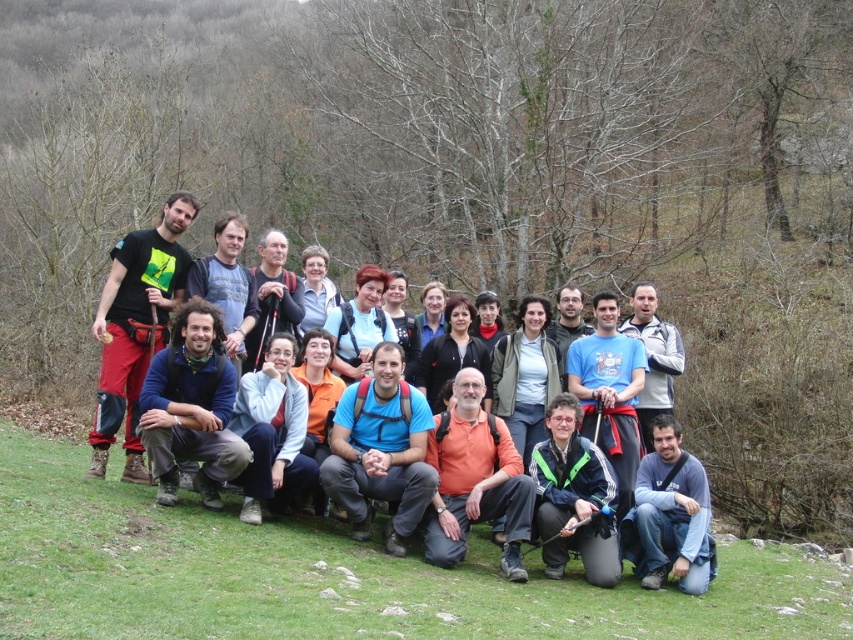
You are standing at point (674, 515) and want to walk to the forest edge. There is another point at (173, 228). Which direction should you move relative to that point?

Since point (173, 228) is behind point (674, 515), you should move in the opposite direction of point (173, 228) to reach the forest edge.